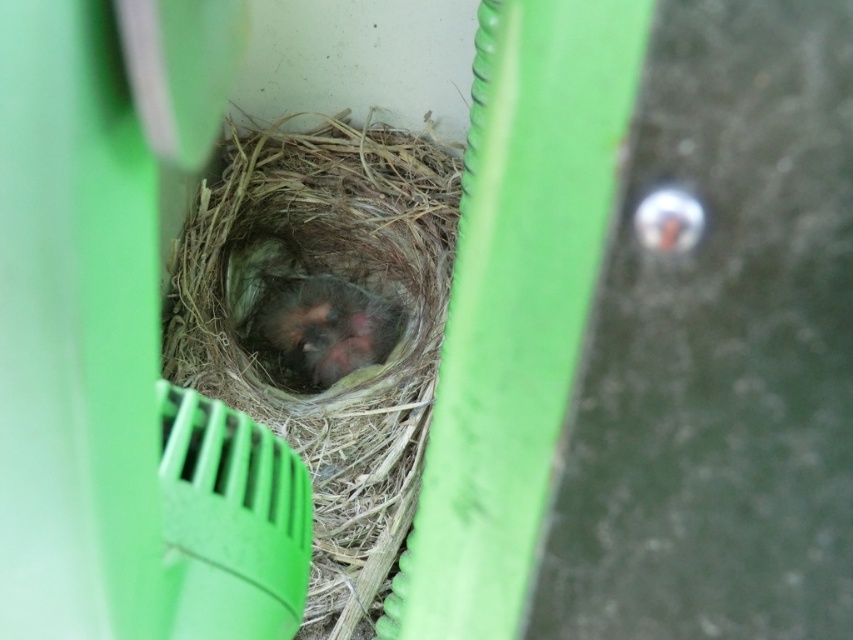
Does brown straw nest at center appear on the left side of fluffy downy chicks at center?

No, brown straw nest at center is not to the left of fluffy downy chicks at center.

Is brown straw nest at center wider than fluffy downy chicks at center?

Yes, brown straw nest at center is wider than fluffy downy chicks at center.

Describe the element at coordinates (323, 326) in the screenshot. This screenshot has height=640, width=853. I see `brown straw nest at center` at that location.

Locate an element on the screen. The image size is (853, 640). brown straw nest at center is located at coordinates (323, 326).